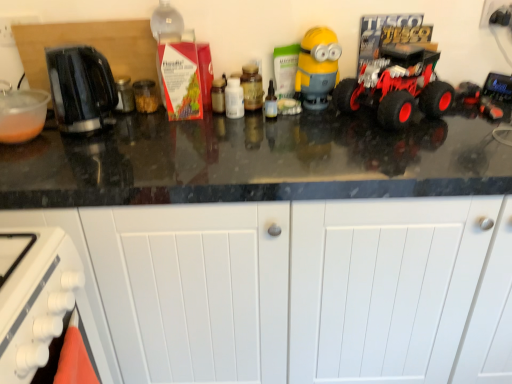
Where is `vacant space positioned to the left of transparent glass bottle at center, acting as the 3th bottle starting from the left`? vacant space positioned to the left of transparent glass bottle at center, acting as the 3th bottle starting from the left is located at coordinates (215, 123).